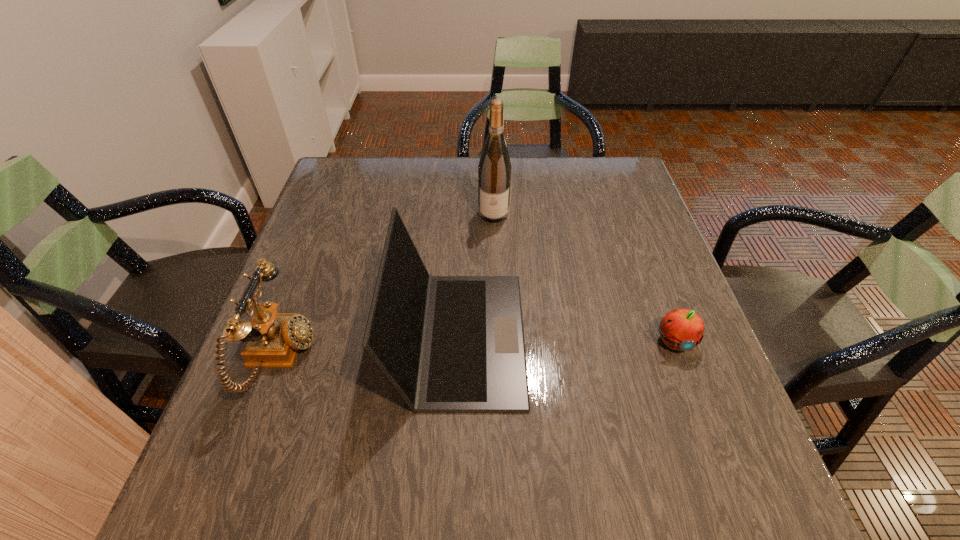
Where is `vacant space located 0.220m on the left of the shortest object`? The image size is (960, 540). vacant space located 0.220m on the left of the shortest object is located at coordinates (544, 341).

Where is `object situated at the left edge`? This screenshot has height=540, width=960. object situated at the left edge is located at coordinates [x=272, y=339].

The height and width of the screenshot is (540, 960). Find the location of `object that is at the right edge`. object that is at the right edge is located at coordinates [681, 329].

The width and height of the screenshot is (960, 540). Identify the location of vacant area at the far edge. (389, 179).

The height and width of the screenshot is (540, 960). I want to click on vacant position at the near edge of the desktop, so click(408, 498).

Locate an element on the screen. The image size is (960, 540). vacant region at the left edge of the desktop is located at coordinates (318, 380).

Identify the location of vacant region at the right edge of the desktop. The width and height of the screenshot is (960, 540). (608, 260).

At what (x,y) coordinates should I click in order to perform the action: click on vacant space at the near left corner of the desktop. Please return your answer as a coordinate pair (x, y). Image resolution: width=960 pixels, height=540 pixels. Looking at the image, I should click on (237, 482).

Locate an element on the screen. The image size is (960, 540). unoccupied area between the shortest object and the third shortest object is located at coordinates (566, 339).

At what (x,y) coordinates should I click in order to perform the action: click on free space between the second tallest object and the shortest object. Please return your answer as a coordinate pair (x, y). Looking at the image, I should click on (566, 339).